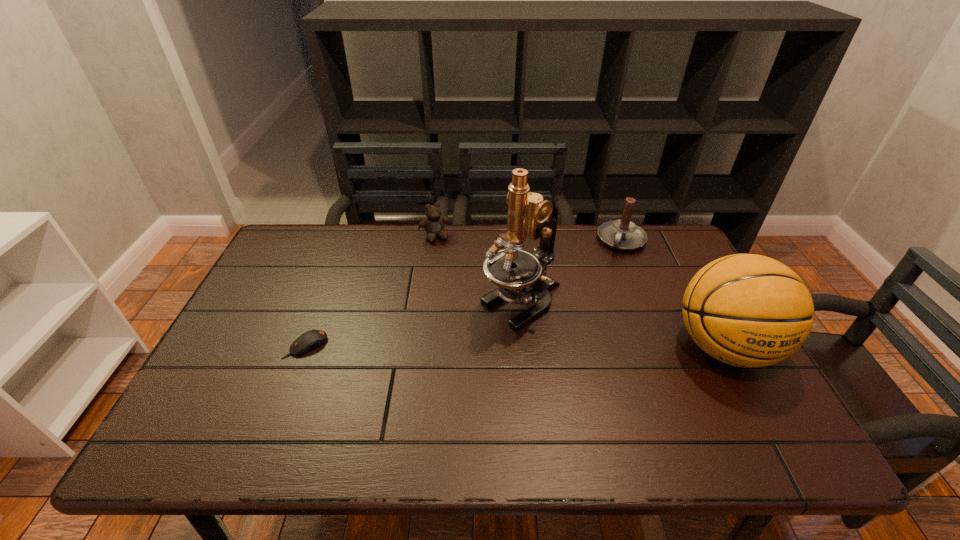
Locate an element on the screen. This screenshot has height=540, width=960. object that is the closest to the teddy bear is located at coordinates click(521, 276).

This screenshot has height=540, width=960. I want to click on free space that satisfies the following two spatial constraints: 1. on the back side of the teddy bear; 2. on the right side of the leftmost object, so click(x=348, y=237).

The width and height of the screenshot is (960, 540). I want to click on vacant region that satisfies the following two spatial constraints: 1. on the back side of the leftmost object; 2. on the right side of the candle, so click(347, 240).